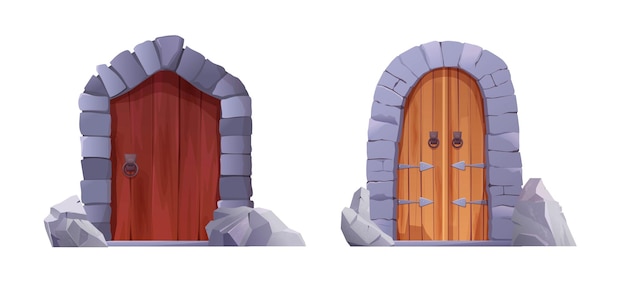
Locate an element on the screen. The height and width of the screenshot is (294, 626). door handles is located at coordinates (434, 141), (459, 135).